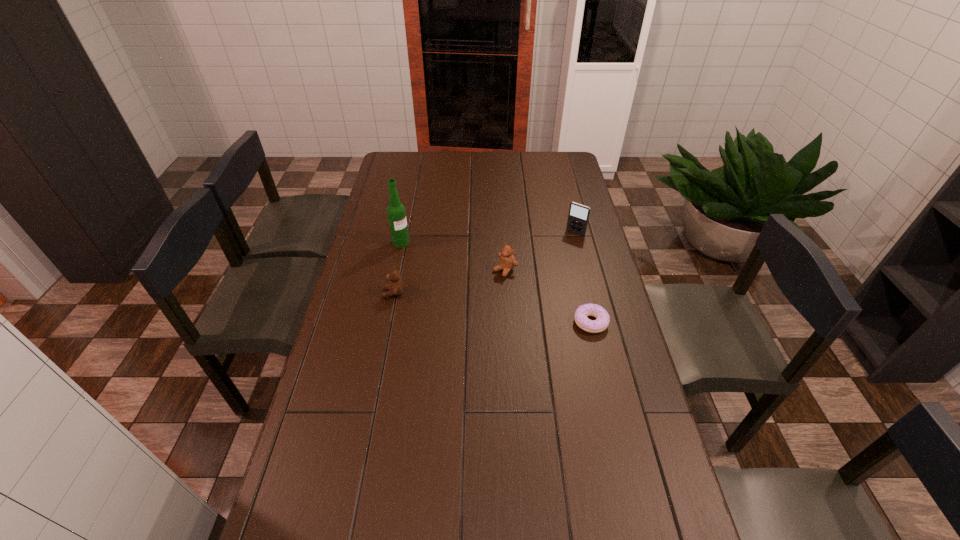
This screenshot has height=540, width=960. I want to click on vacant space that's between the farther teddy bear and the beer bottle, so click(x=453, y=256).

At what (x,y) coordinates should I click in order to perform the action: click on vacant space that's between the nearest object and the iPod. Please return your answer as a coordinate pair (x, y). The image size is (960, 540). Looking at the image, I should click on (583, 278).

In order to click on free space between the third nearest object and the left teddy bear in this screenshot , I will do coord(449,281).

Image resolution: width=960 pixels, height=540 pixels. What are the coordinates of `free point between the second tallest object and the beer bottle` in the screenshot? It's located at (489, 238).

You are a GUI agent. You are given a task and a screenshot of the screen. Output one action in this format:
    pyautogui.click(x=<x>, y=<y>)
    Task: Click on the empty space that is in between the nearest object and the beer bottle
    This screenshot has height=540, width=960.
    Given the screenshot: What is the action you would take?
    pyautogui.click(x=495, y=282)

At what (x,y) coordinates should I click in order to perform the action: click on empty space between the fourth farthest object and the second tallest object. Please return your answer as a coordinate pair (x, y). Image resolution: width=960 pixels, height=540 pixels. Looking at the image, I should click on (485, 262).

Image resolution: width=960 pixels, height=540 pixels. Identify the location of free space between the beer bottle and the third object from right to left. (453, 256).

Locate an element on the screen. This screenshot has height=540, width=960. vacant area between the second tallest object and the second farthest object is located at coordinates (489, 238).

The height and width of the screenshot is (540, 960). I want to click on blank region between the beer bottle and the nearer teddy bear, so click(397, 268).

Identify the location of free point between the farthest object and the second farthest object. (489, 238).